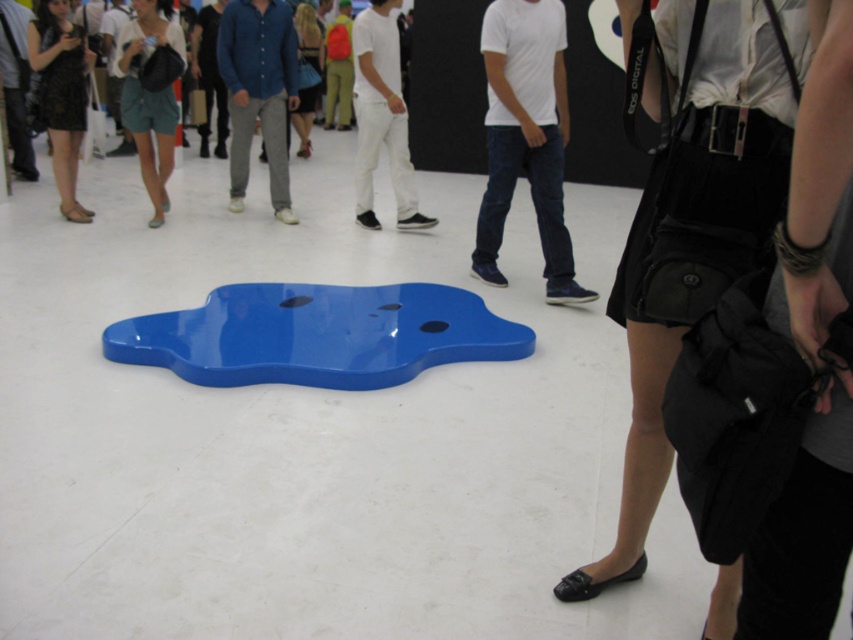
Question: Which object appears closest to the camera in this image?

Choices:
 (A) matte blue pants at center
 (B) black fabric bag at lower right
 (C) matte black shorts at left

Answer: (B)

Question: Does black leather bag at lower right have a lesser width compared to white matte pants at center?

Choices:
 (A) no
 (B) yes

Answer: (B)

Question: Which point is closer to the camera taking this photo?

Choices:
 (A) (814, 408)
 (B) (508, 24)
 (C) (84, 51)
 (D) (399, 112)

Answer: (A)

Question: Can you confirm if black leather bag at lower right is smaller than black fabric bag at lower right?

Choices:
 (A) yes
 (B) no

Answer: (B)

Question: Is black fabric bag at lower right bigger than white matte t-shirt at center?

Choices:
 (A) yes
 (B) no

Answer: (B)

Question: Which is nearer to the matte black dress at left?

Choices:
 (A) matte blue pants at center
 (B) white matte t-shirt at center
 (C) matte black shorts at left
 (D) black fabric bag at lower right

Answer: (C)